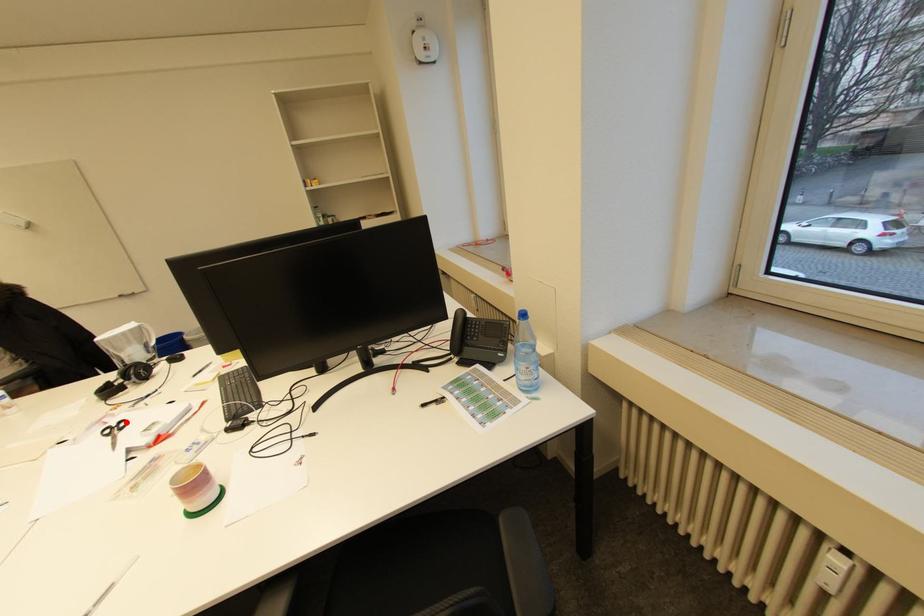
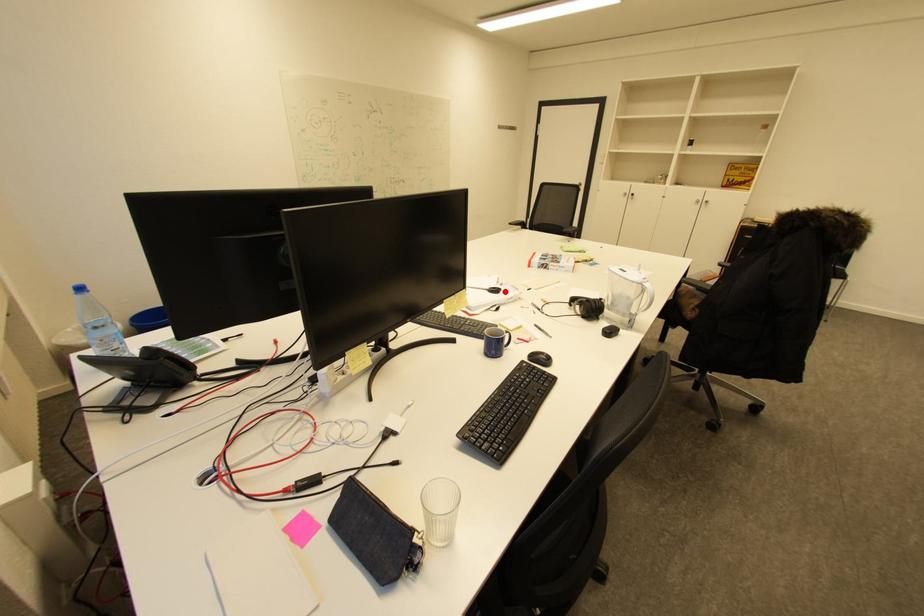
Consider the image. I am providing you with two images of the same scene from different viewpoints. A red point is marked on the first image and another point is marked on the second image. Is the marked point in image1 the same physical position as the marked point in image2?

Yes